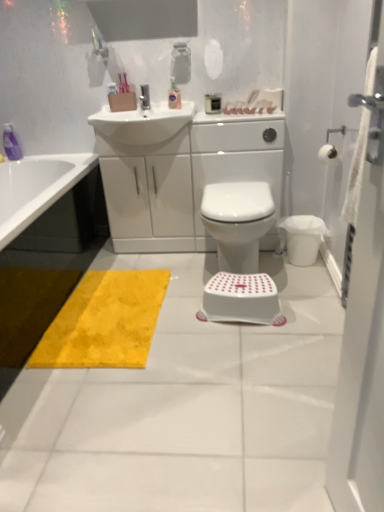
The width and height of the screenshot is (384, 512). What are the coordinates of `vacant space in front of yellow fuzzy rug at lower left` in the screenshot? It's located at (123, 405).